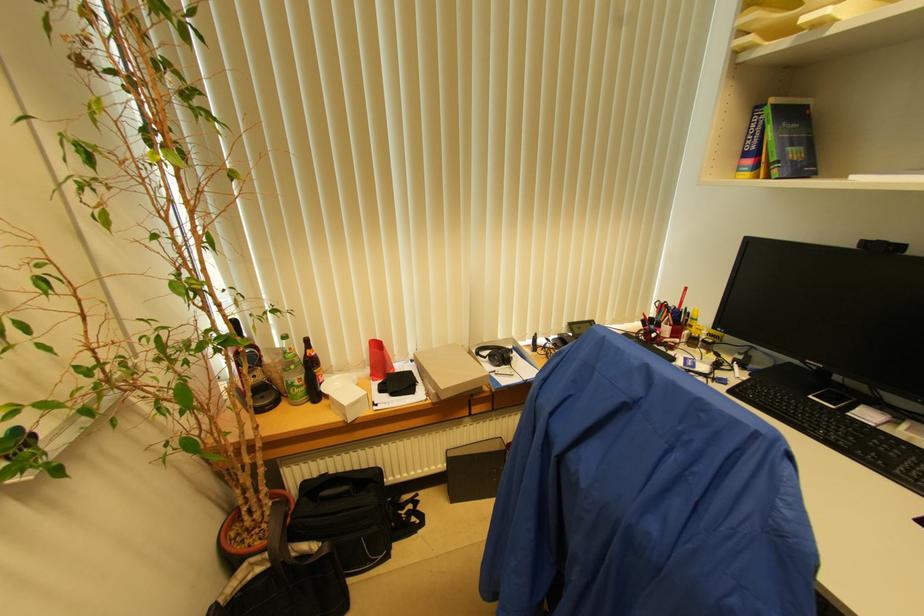
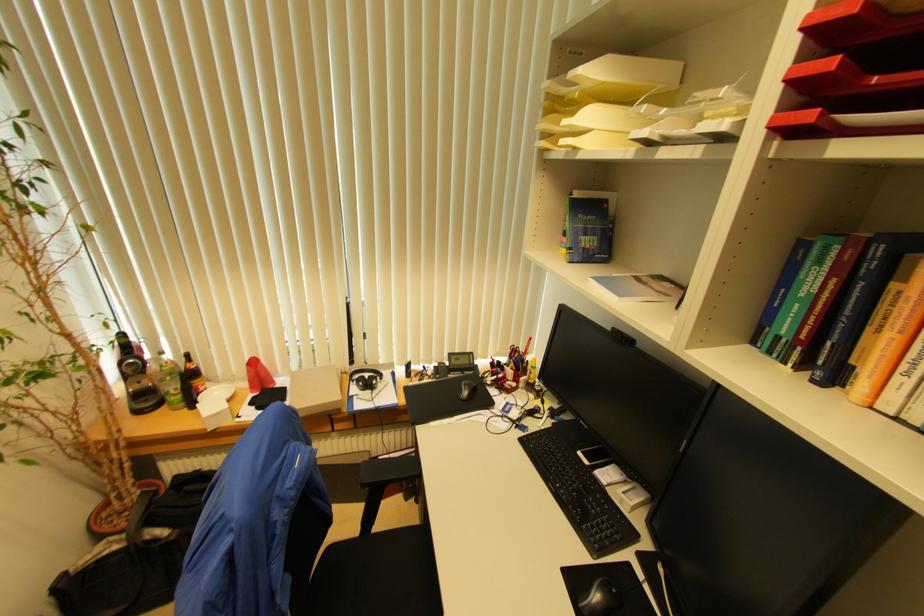
Question: In a continuous first-person perspective shot, in which direction is the camera moving?

Choices:
 (A) Left
 (B) Right
 (C) Forward
 (D) Backward

Answer: (B)